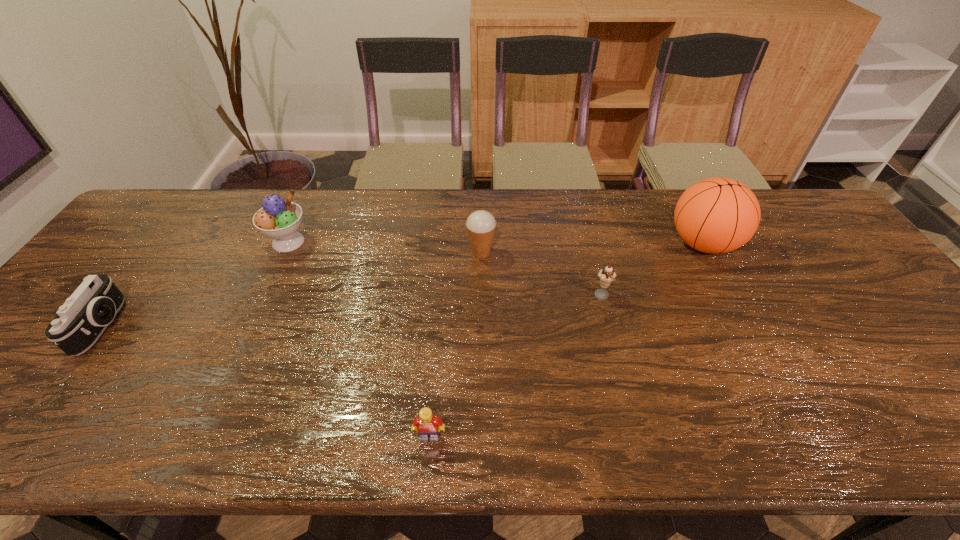
In the image, there is a desktop. At what (x,y) coordinates should I click in order to perform the action: click on vacant space at the right edge. Please return your answer as a coordinate pair (x, y). Looking at the image, I should click on (857, 302).

Where is `blank space at the far left corner`? blank space at the far left corner is located at coordinates (137, 234).

At what (x,y) coordinates should I click in order to perform the action: click on vacant area that lies between the second object from right to left and the fifth object from right to left. Please return your answer as a coordinate pair (x, y). The height and width of the screenshot is (540, 960). Looking at the image, I should click on (445, 269).

At what (x,y) coordinates should I click in order to perform the action: click on free space that is in between the shortest icecream and the Lego. Please return your answer as a coordinate pair (x, y). The height and width of the screenshot is (540, 960). Looking at the image, I should click on (516, 367).

The image size is (960, 540). Identify the location of vacant area between the Lego and the third object from right to left. (455, 345).

Where is `free space between the fifth object from right to left and the nearest object`? This screenshot has width=960, height=540. free space between the fifth object from right to left and the nearest object is located at coordinates (359, 339).

This screenshot has width=960, height=540. What are the coordinates of `blank region between the Lego and the camera` in the screenshot? It's located at (267, 381).

Where is `free space between the second object from left to right and the shortest icecream`? Image resolution: width=960 pixels, height=540 pixels. free space between the second object from left to right and the shortest icecream is located at coordinates (445, 269).

I want to click on vacant area between the tallest object and the second icecream from left to right, so click(592, 248).

At what (x,y) coordinates should I click in order to perform the action: click on vacant region between the fourth object from left to right and the shortest icecream. Please return your answer as a coordinate pair (x, y). The image size is (960, 540). Looking at the image, I should click on (541, 274).